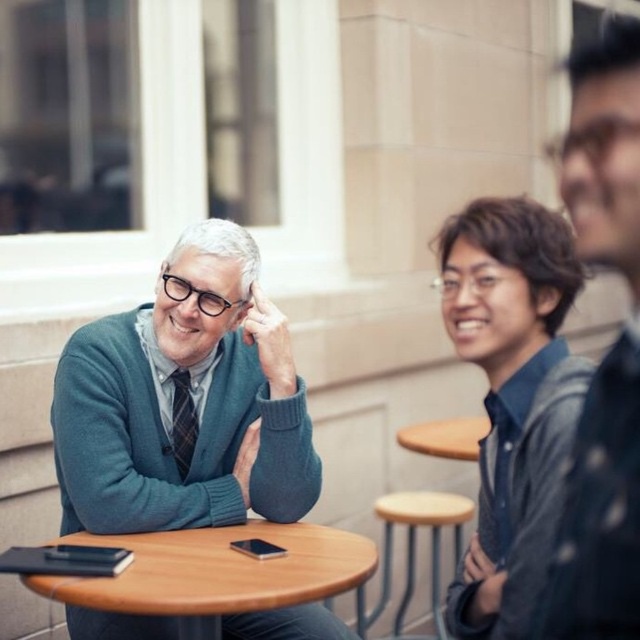
Based on the photo, between teal sweater at center and matte blue shirt at center, which one has less height?

With less height is matte blue shirt at center.

Can you confirm if teal sweater at center is shorter than matte blue shirt at center?

Incorrect, teal sweater at center's height does not fall short of matte blue shirt at center's.

Find the location of a particular element. This screenshot has height=640, width=640. teal sweater at center is located at coordinates (184, 403).

Does wooden round table at center have a greater height compared to wooden stool at lower center?

No, wooden round table at center is not taller than wooden stool at lower center.

Image resolution: width=640 pixels, height=640 pixels. What are the coordinates of `wooden round table at center` in the screenshot? It's located at tap(218, 570).

In order to click on wooden round table at center in this screenshot , I will do `click(218, 570)`.

Is point (184, 385) less distant than point (388, 586)?

Yes, point (184, 385) is in front of point (388, 586).

Who is shorter, teal sweater at center or wooden stool at lower center?

Standing shorter between the two is wooden stool at lower center.

Where is `teal sweater at center`? The width and height of the screenshot is (640, 640). teal sweater at center is located at coordinates (184, 403).

Find the location of a particular element. teal sweater at center is located at coordinates (184, 403).